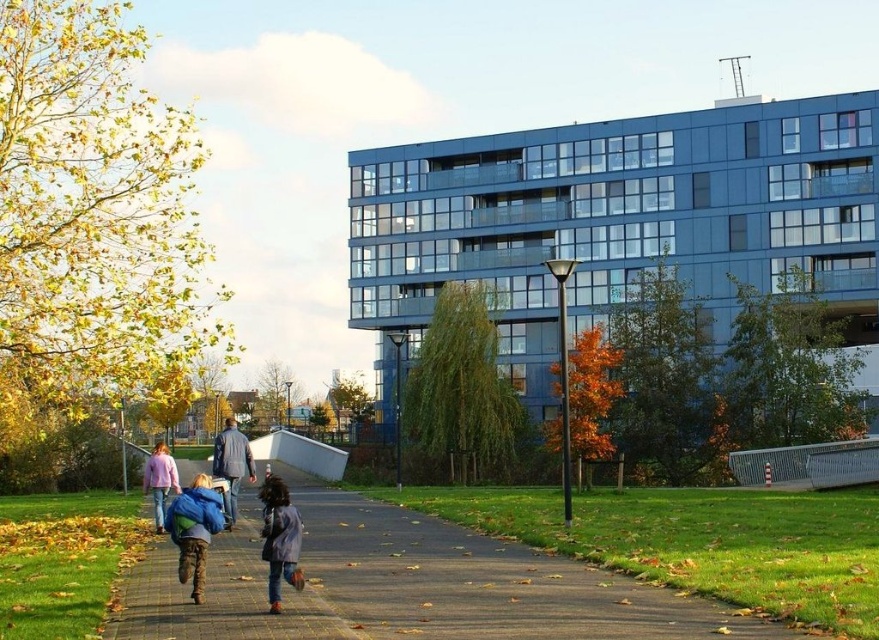
You are standing at the entrance of the park and see the brown brick pavement at lower left and the pink fabric jacket at center. Which object is closer to you?

The brown brick pavement at lower left is closer to you because it is in front of the pink fabric jacket at center.

You are standing at the point marked by the coordinates point (220, 595) in the image. What is the material of the surface you are currently standing on?

The point (220, 595) marks brown brick pavement at lower left, so the surface is made of brown brick.